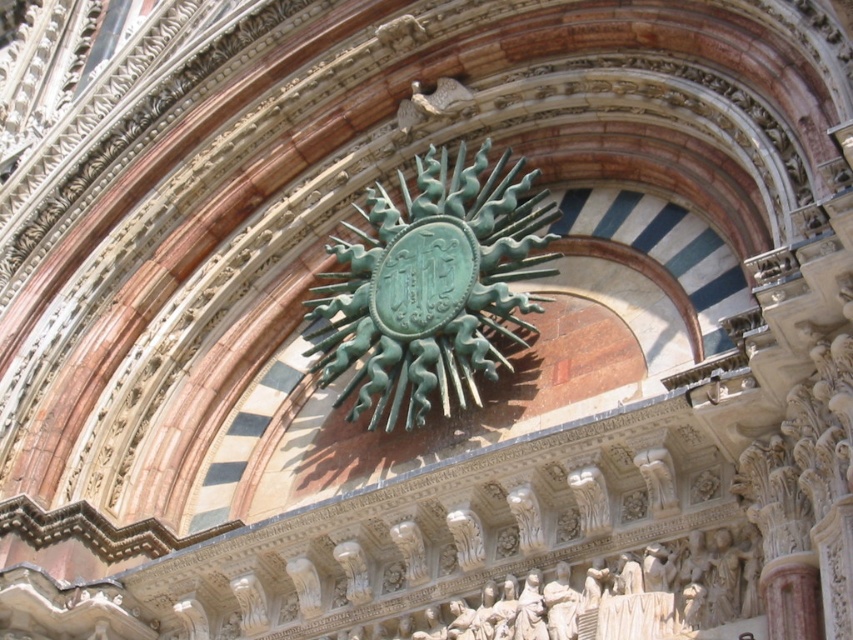
Question: Among these objects, which one is nearest to the camera?

Choices:
 (A) white stone figures at lower center
 (B) white marble statue at lower center
 (C) green patina eagle at upper center

Answer: (A)

Question: Does white stone figures at lower center have a greater width compared to white marble statue at lower center?

Choices:
 (A) yes
 (B) no

Answer: (A)

Question: Which is nearer to the white marble statue at lower center?

Choices:
 (A) white stone figures at lower center
 (B) green patina eagle at upper center
 (C) green patina metal sunburst at center

Answer: (A)

Question: Is green patina metal sunburst at center below white marble statue at lower center?

Choices:
 (A) yes
 (B) no

Answer: (B)

Question: Is green patina metal sunburst at center closer to the viewer compared to white marble statue at lower center?

Choices:
 (A) no
 (B) yes

Answer: (A)

Question: Considering the real-world distances, which object is farthest from the white marble statue at lower center?

Choices:
 (A) green patina metal sunburst at center
 (B) green patina eagle at upper center

Answer: (B)